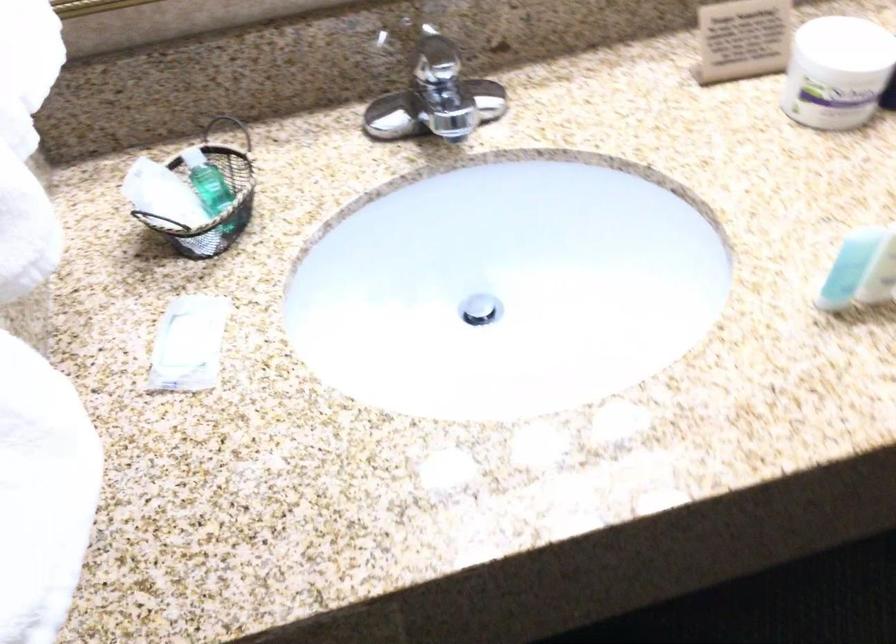
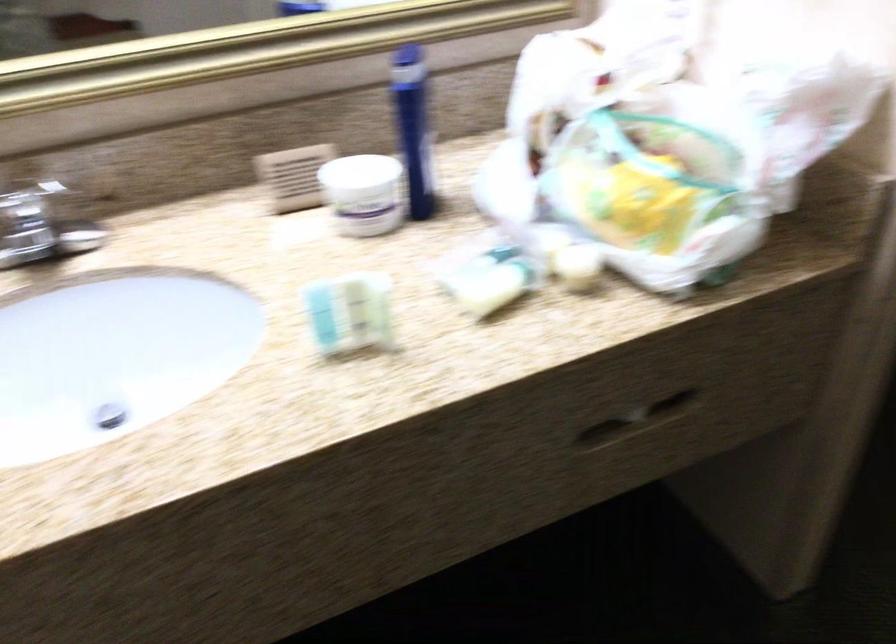
Question: The first image is from the beginning of the video and the second image is from the end. How did the camera likely rotate when shooting the video?

Choices:
 (A) Left
 (B) Right
 (C) Up
 (D) Down

Answer: (C)